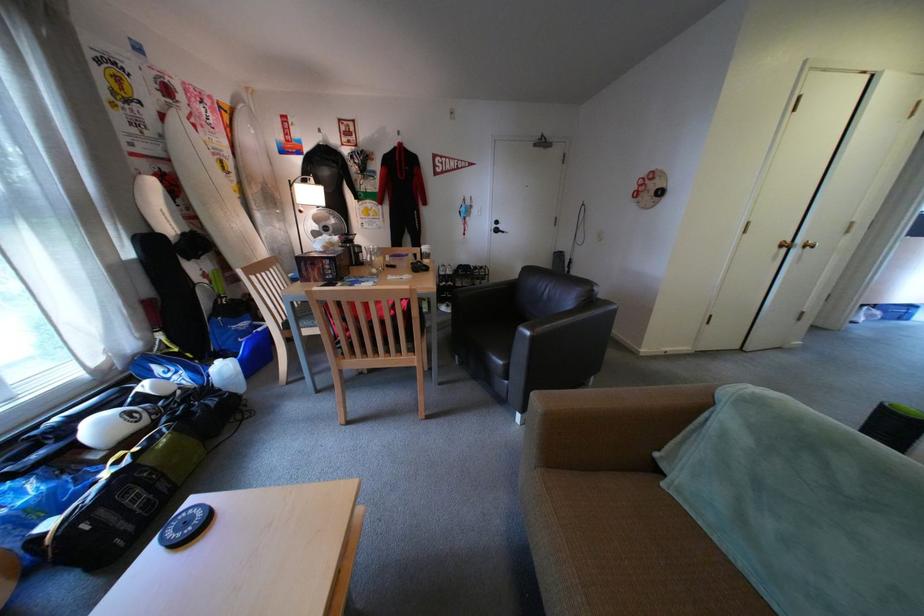
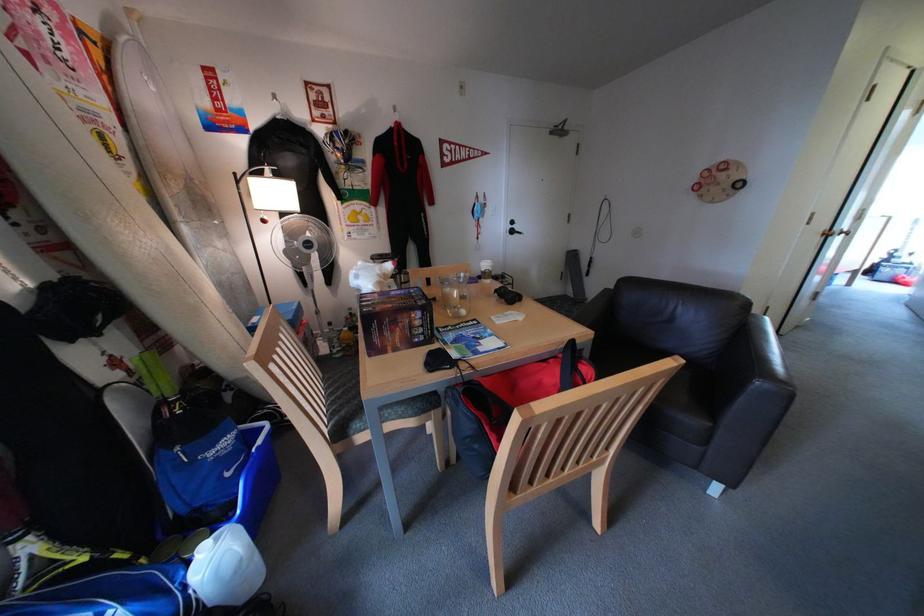
The images are taken continuously from a first-person perspective. In which direction are you moving?

The movement direction of the cameraman is left, forward.